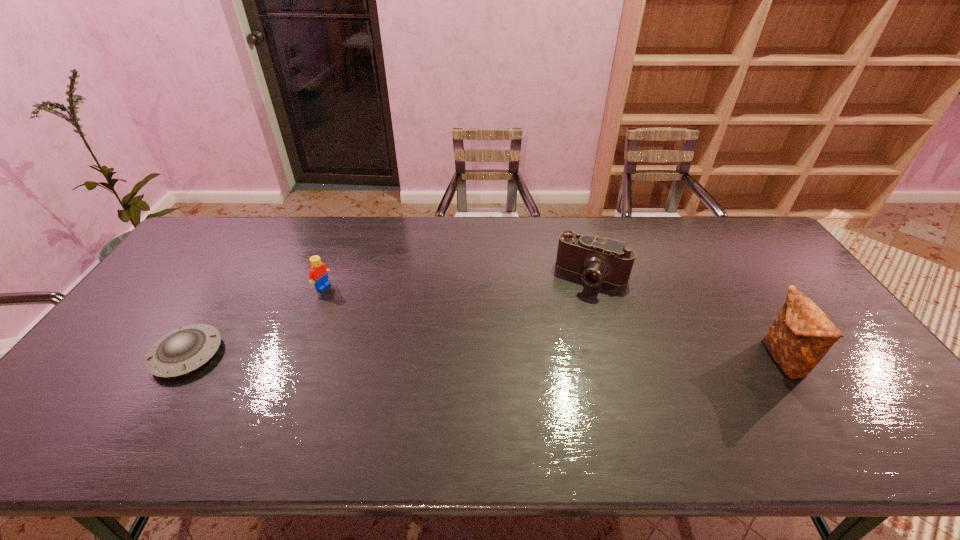
Identify the location of free spot between the camera and the tallest object. Image resolution: width=960 pixels, height=540 pixels. (687, 318).

Identify the location of unoccupied position between the shortest object and the rightmost object. (485, 357).

Locate an element on the screen. The image size is (960, 540). free space between the clutch bag and the saucer is located at coordinates (485, 357).

The height and width of the screenshot is (540, 960). Identify the location of empty location between the camera and the saucer. (390, 315).

This screenshot has width=960, height=540. Find the location of `free space between the Lego and the camera`. free space between the Lego and the camera is located at coordinates (458, 281).

Locate which object ranks in proximity to the leftmost object. Please provide its 2D coordinates. Your answer should be formatted as a tuple, i.e. [(x, y)], where the tuple contains the x and y coordinates of a point satisfying the conditions above.

[(318, 275)]

Where is `the third closest object relative to the camera`? The width and height of the screenshot is (960, 540). the third closest object relative to the camera is located at coordinates (185, 349).

You are a GUI agent. You are given a task and a screenshot of the screen. Output one action in this format:
    pyautogui.click(x=<x>, y=<y>)
    Task: Click on the free spot that satisfies the following two spatial constraints: 1. on the back side of the second object from left to right; 2. on the left side of the camera
    The width and height of the screenshot is (960, 540).
    Given the screenshot: What is the action you would take?
    pyautogui.click(x=327, y=275)

Where is `free space that satisfies the following two spatial constraints: 1. on the back side of the leftmost object; 2. on the right side of the Lego`? free space that satisfies the following two spatial constraints: 1. on the back side of the leftmost object; 2. on the right side of the Lego is located at coordinates (230, 286).

This screenshot has width=960, height=540. In order to click on vacant region that satisfies the following two spatial constraints: 1. on the front side of the camera; 2. on the open side of the tallest object in this screenshot , I will do `click(617, 360)`.